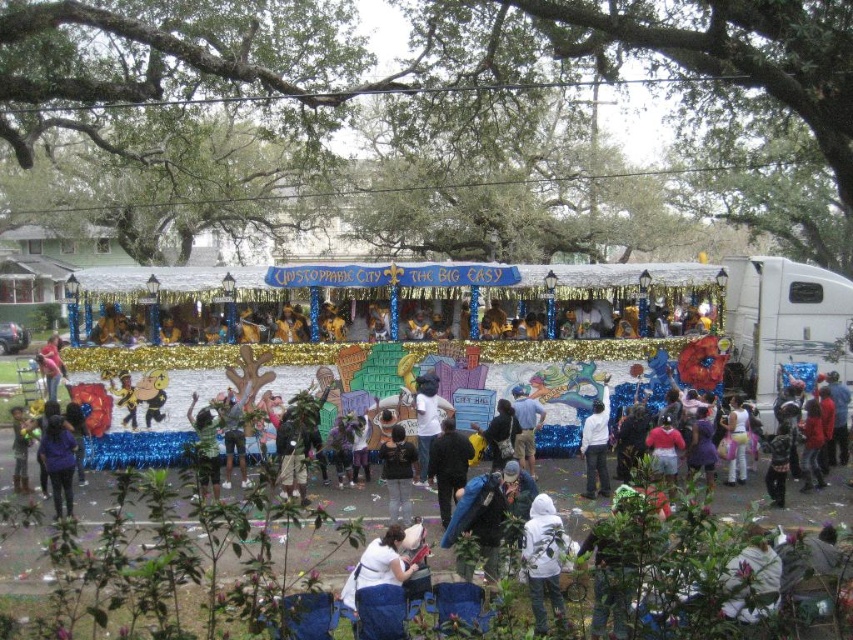
Which is more to the right, white fleece hoodie at lower center or black matte jacket at center?

Positioned to the right is white fleece hoodie at lower center.

Describe the element at coordinates (543, 557) in the screenshot. The image size is (853, 640). I see `white fleece hoodie at lower center` at that location.

Who is more distant from viewer, (540, 584) or (463, 451)?

The point (463, 451) is more distant.

You are a GUI agent. You are given a task and a screenshot of the screen. Output one action in this format:
    pyautogui.click(x=<x>, y=<y>)
    Task: Click on the white fleece hoodie at lower center
    
    Given the screenshot: What is the action you would take?
    pyautogui.click(x=543, y=557)

Is black matte jacket at center positioned before matte pink shirt at center?

Yes, it is.

Who is higher up, black matte jacket at center or matte pink shirt at center?

matte pink shirt at center is above.

Is point (440, 461) behind point (47, 394)?

That is False.

Find the location of `black matte jacket at center`. black matte jacket at center is located at coordinates (448, 465).

In the scene shown: Measure the distance between black matte jacket at center and matte purple jacket at lower left.

They are 46.23 feet apart.

In the scene shown: Which is above, black matte jacket at center or matte purple jacket at lower left?

matte purple jacket at lower left

I want to click on black matte jacket at center, so click(x=448, y=465).